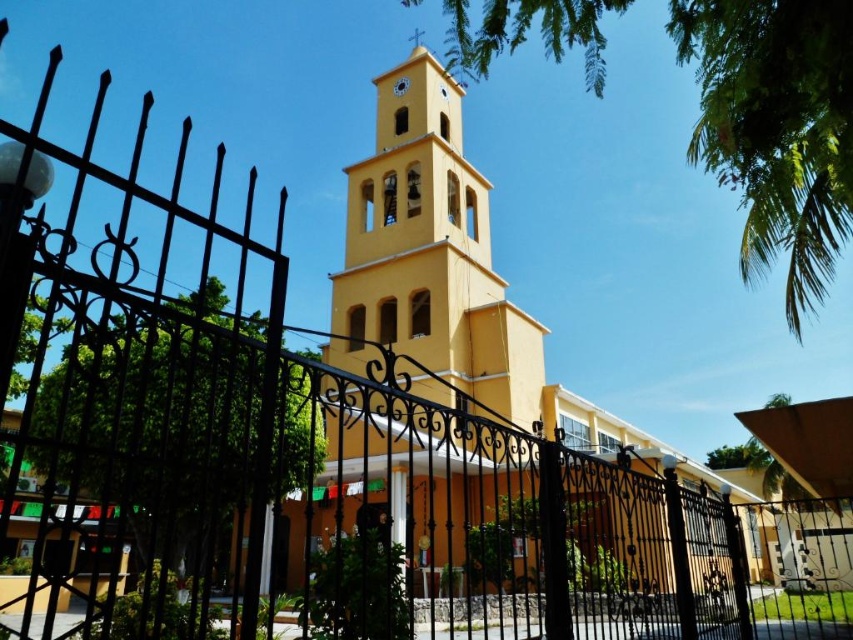
You are standing in front of the church and notice two points marked on the bell tower. The first point is at coordinates point (x=428, y=288) and the second is at point (x=409, y=83). Which point is closer to you?

Point (x=428, y=288) is closer to the camera than point (x=409, y=83).

You are standing in front of the church and notice two yellow elements, the yellow matte bell tower at center and the matte yellow clock at upper center. Which one is located to the right of the other?

The yellow matte bell tower at center is positioned on the right side of the matte yellow clock at upper center, so the bell tower is to the right of the clock.